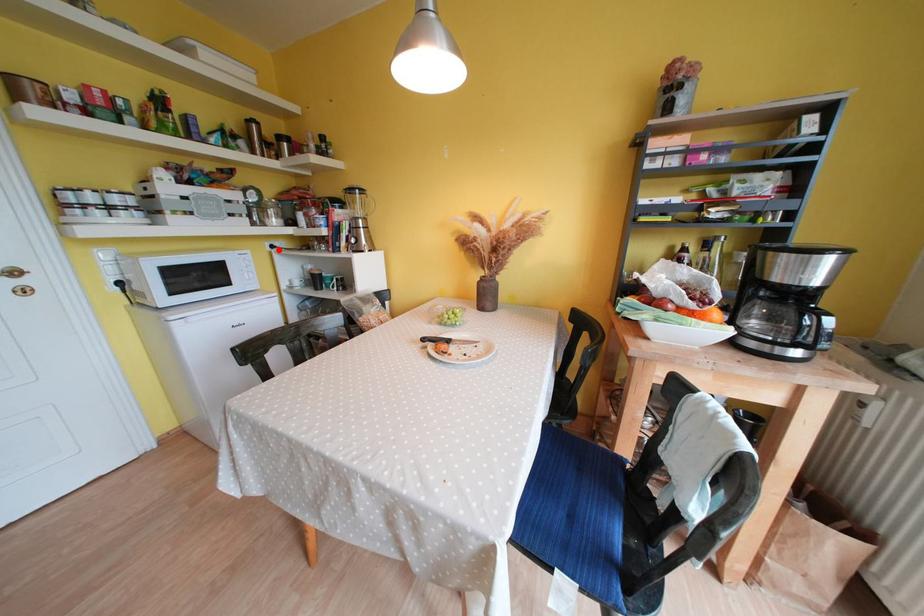
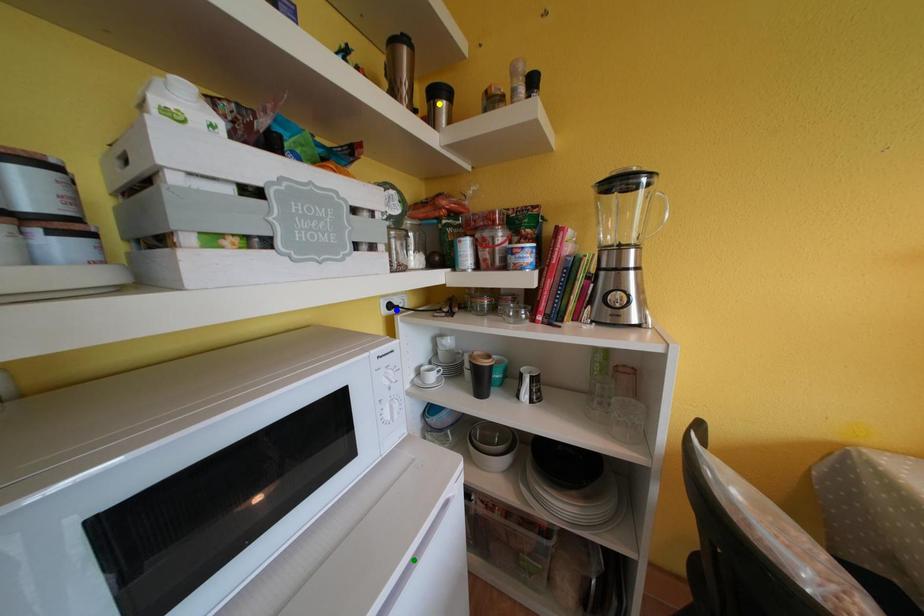
Question: I am providing you with two images of the same scene from different viewpoints. A red point is marked on the first image. You are given multiple points on the second image. Can you choose the point in image 2 that corresponds to the point in image 1?

Choices:
 (A) yellow point
 (B) green point
 (C) blue point

Answer: (C)